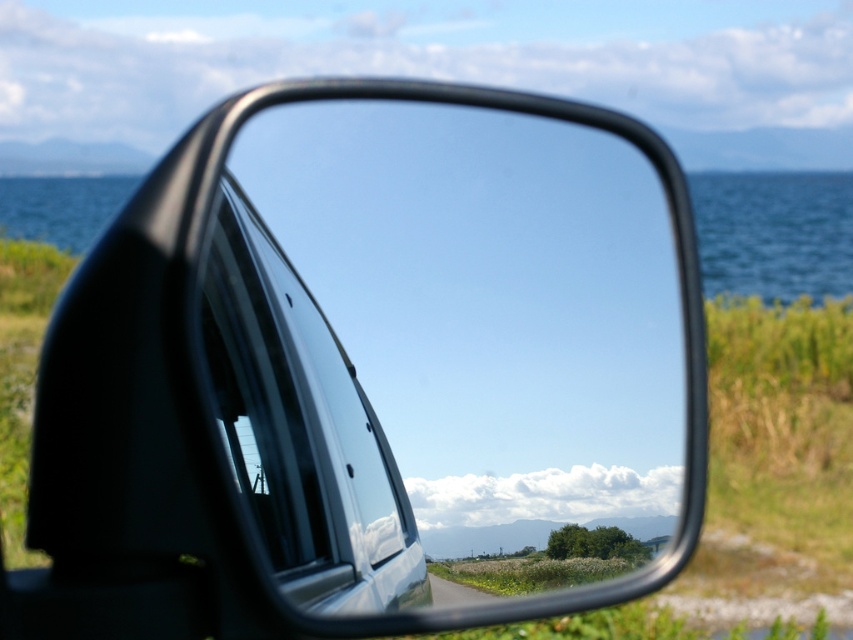
Question: Estimate the real-world distances between objects in this image. Which object is closer to the blue water at center?

Choices:
 (A) transparent glass car window at center
 (B) black glossy mirror at center

Answer: (A)

Question: Is black glossy mirror at center to the left of transparent glass car window at center from the viewer's perspective?

Choices:
 (A) yes
 (B) no

Answer: (A)

Question: Estimate the real-world distances between objects in this image. Which object is closer to the blue water at center?

Choices:
 (A) transparent glass car window at center
 (B) black glossy mirror at center

Answer: (A)

Question: Which point is farther to the camera?

Choices:
 (A) (235, 170)
 (B) (258, 312)

Answer: (B)

Question: Can you confirm if black glossy mirror at center is positioned above blue water at center?

Choices:
 (A) no
 (B) yes

Answer: (A)

Question: Can you confirm if black glossy mirror at center is bigger than transparent glass car window at center?

Choices:
 (A) no
 (B) yes

Answer: (A)